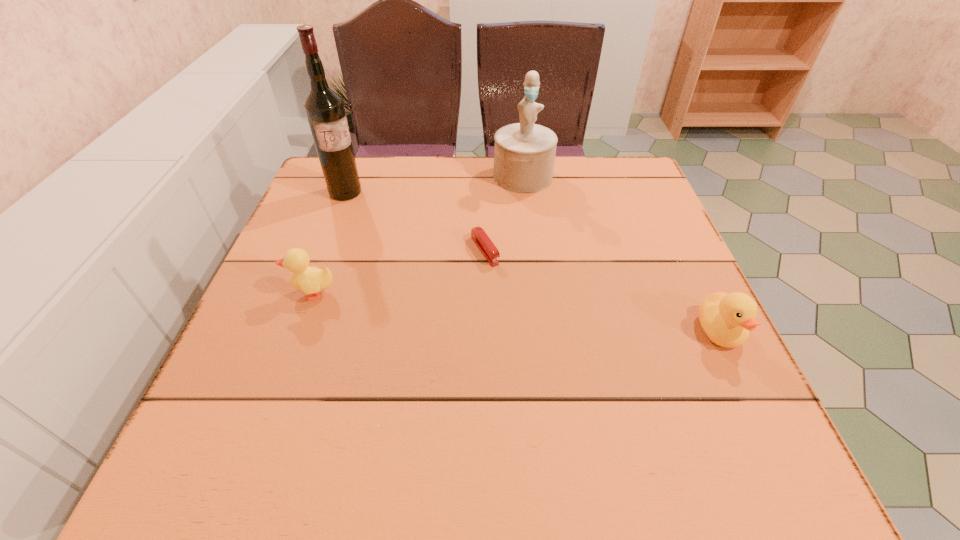
Find the location of a particular element. This screenshot has width=960, height=540. free region located on the front-facing side of the third farthest object is located at coordinates (544, 340).

At what (x,y) coordinates should I click in order to perform the action: click on vacant space situated on the front and back of the tallest object. Please return your answer as a coordinate pair (x, y). Looking at the image, I should click on (410, 259).

Image resolution: width=960 pixels, height=540 pixels. Identify the location of vacant space located 0.280m on the front and back of the tallest object. (410, 259).

Find the location of a particular element. vacant space located 0.110m on the front and back of the tallest object is located at coordinates (373, 221).

In order to click on free spot located 0.310m at the beak of the second tallest object in this screenshot , I will do `click(525, 278)`.

The height and width of the screenshot is (540, 960). Find the location of `vacant area located 0.070m at the beak of the second tallest object`. vacant area located 0.070m at the beak of the second tallest object is located at coordinates (523, 210).

The width and height of the screenshot is (960, 540). Identify the location of free space located 0.150m at the beak of the second tallest object. (524, 230).

Where is `wine bottle present at the far edge`? Image resolution: width=960 pixels, height=540 pixels. wine bottle present at the far edge is located at coordinates [324, 108].

Image resolution: width=960 pixels, height=540 pixels. I want to click on figurine located in the far edge section of the desktop, so click(524, 153).

You are a GUI agent. You are given a task and a screenshot of the screen. Output one action in this format:
    pyautogui.click(x=<x>, y=<y>)
    Task: Click on the duckling that is positioned at the left edge
    The image size is (960, 540).
    Given the screenshot: What is the action you would take?
    click(x=309, y=280)